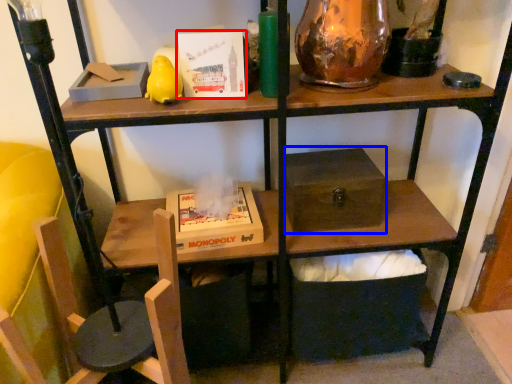
Question: Which of the following is the farthest to the observer, paperback book (highlighted by a red box) or box (highlighted by a blue box)?

Choices:
 (A) paperback book
 (B) box

Answer: (B)